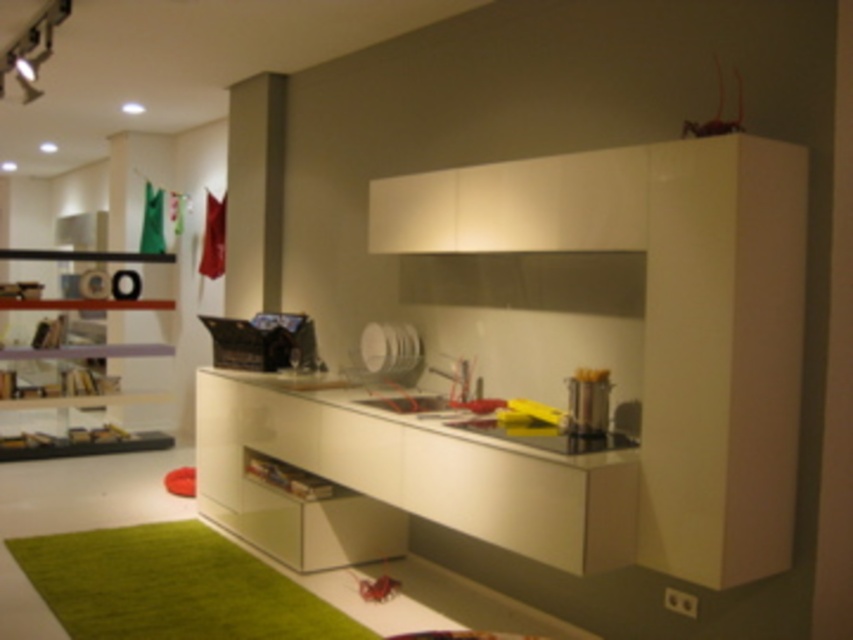
You are designing a kitchen layout and need to place a 15cm wide cutting board on either the white glossy counter top at center or the white glossy drawer at lower center. Based on their sizes, which surface can accommodate the cutting board?

The white glossy counter top at center has a larger width than the white glossy drawer at lower center, so the cutting board can fit on the white glossy counter top at center.

Based on the photo, you are a kitchen designer checking the layout for accessibility. You need to ensure that the white glossy drawer at lower center can be easily reached by someone sitting at the counter. Considering the height of the satin silver pot at center, is the drawer within a comfortable reach zone?

The white glossy drawer at lower center has a greater height than the satin silver pot at center. Since the drawer is taller, it might be positioned higher, potentially making it less accessible for someone sitting at the counter who might need to reach down from a seated position. However, without specific measurements, it is challenging to determine exact comfort. The drawer could still be within reach depending on its exact placement and the user height.